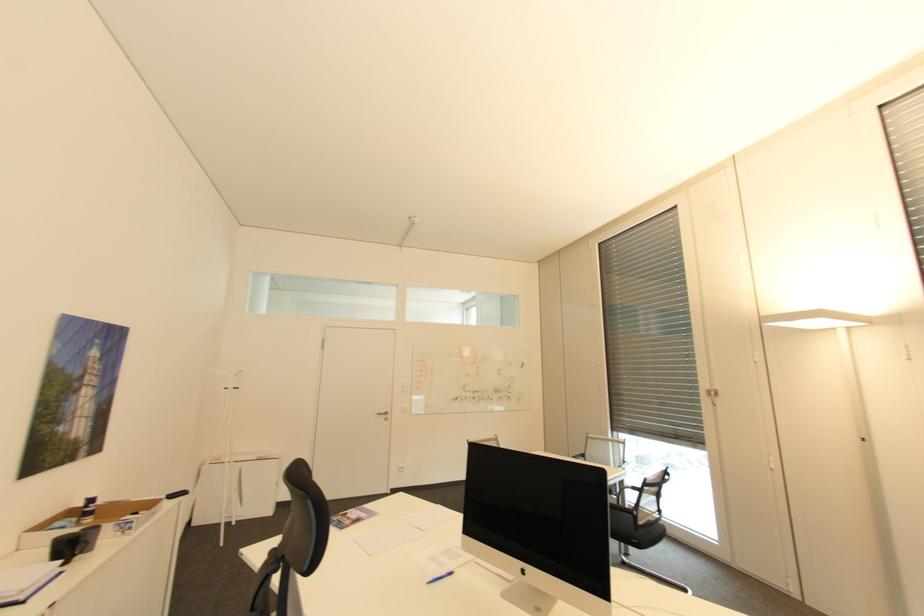
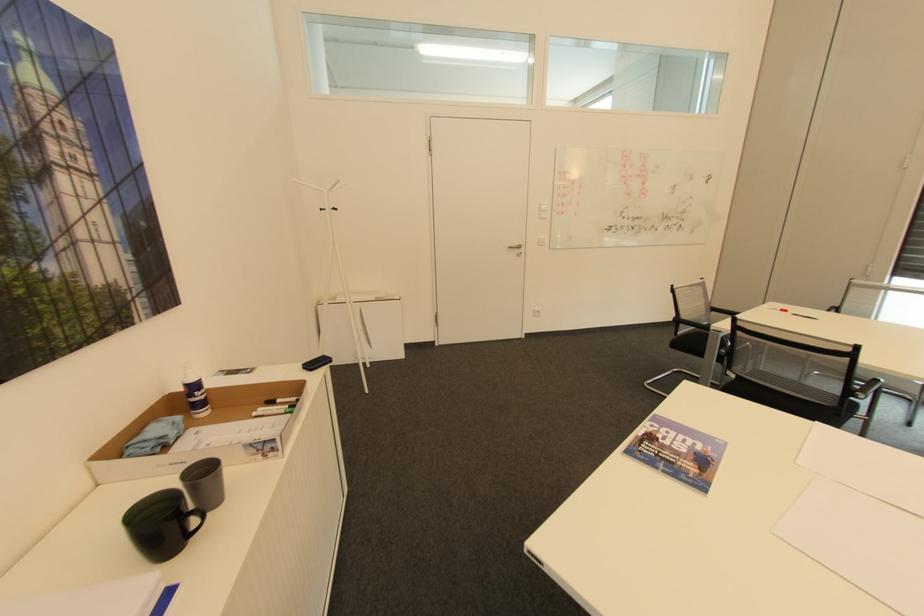
Where in the second image is the point corresponding to pixel 99 495 from the first image?

(197, 379)